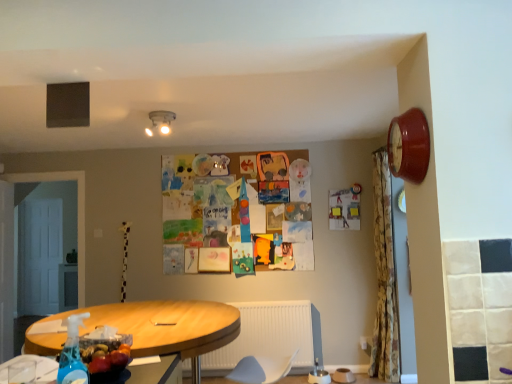
Question: From the image's perspective, relative to shiny plastic bottle of water at lower left, is floral fabric shower curtain at right above or below?

Choices:
 (A) above
 (B) below

Answer: (A)

Question: Which is correct: floral fabric shower curtain at right is inside shiny plastic bottle of water at lower left, or outside of it?

Choices:
 (A) outside
 (B) inside

Answer: (A)

Question: Which object is positioned closest to the wooden table at lower left?

Choices:
 (A) light blue fabric swivel chair at lower center
 (B) blue translucent spray bottle at lower left
 (C) shiny plastic bottle of water at lower left
 (D) floral fabric shower curtain at right
 (E) matte red clock at upper right

Answer: (C)

Question: Which object is positioned farthest from the wooden table at lower left?

Choices:
 (A) floral fabric shower curtain at right
 (B) shiny plastic bottle of water at lower left
 (C) matte white ceiling light at upper center
 (D) blue translucent spray bottle at lower left
 (E) light blue fabric swivel chair at lower center

Answer: (A)